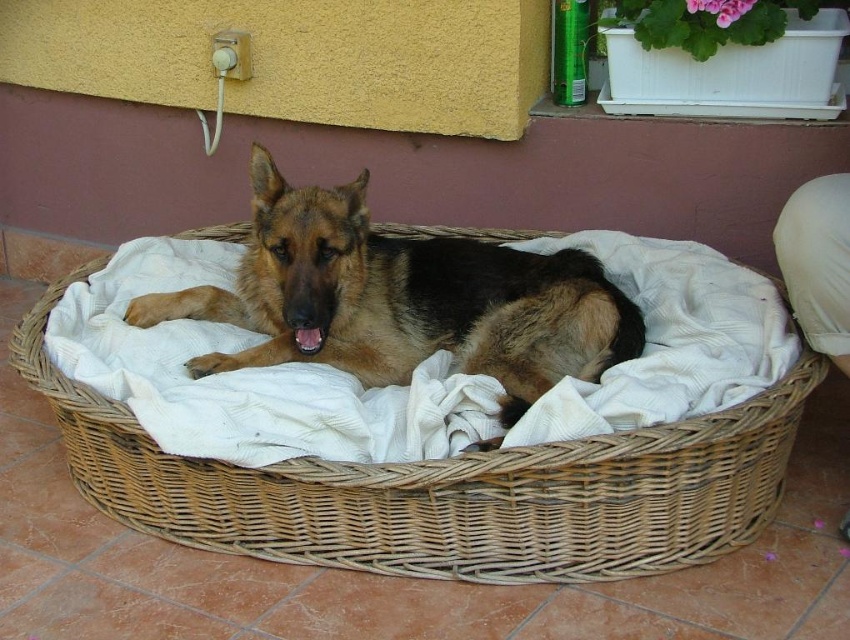
Question: Does woven wicker basket at center lie behind brown fur dog at center?

Choices:
 (A) yes
 (B) no

Answer: (B)

Question: Among these points, which one is nearest to the camera?

Choices:
 (A) (270, 196)
 (B) (697, 442)

Answer: (B)

Question: Does woven wicker basket at center appear on the right side of brown fur dog at center?

Choices:
 (A) yes
 (B) no

Answer: (A)

Question: Which point is closer to the camera?

Choices:
 (A) (306, 317)
 (B) (672, 490)

Answer: (B)

Question: Can you confirm if woven wicker basket at center is positioned below brown fur dog at center?

Choices:
 (A) no
 (B) yes

Answer: (B)